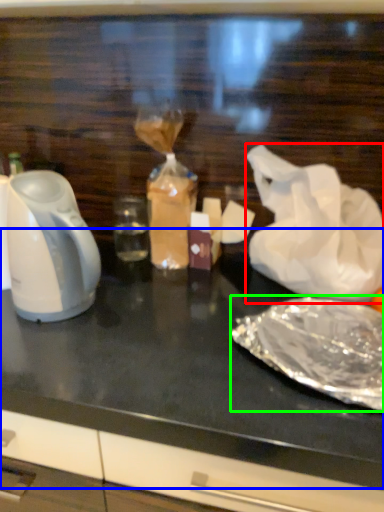
Question: Which object is positioned farthest from plastic bag (highlighted by a red box)? Select from table top (highlighted by a blue box) and food (highlighted by a green box).

Choices:
 (A) table top
 (B) food

Answer: (A)